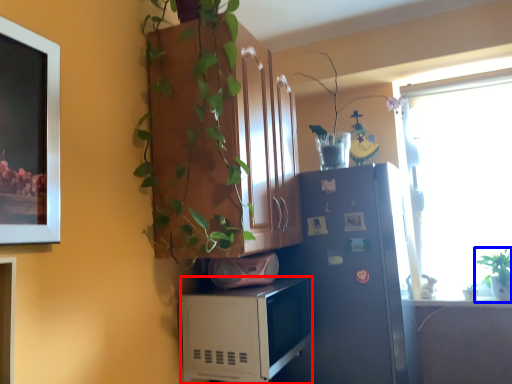
Question: Among these objects, which one is farthest to the camera, microwave oven (highlighted by a red box) or houseplant (highlighted by a blue box)?

Choices:
 (A) microwave oven
 (B) houseplant

Answer: (B)